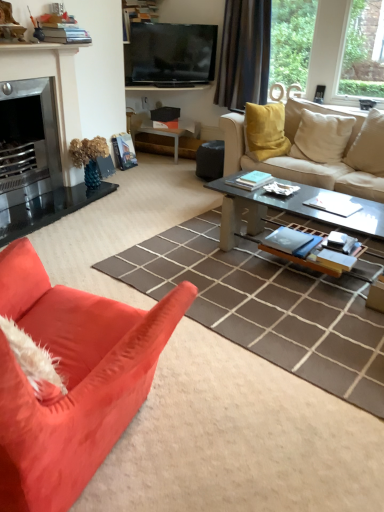
This screenshot has height=512, width=384. Describe the element at coordinates (288, 211) in the screenshot. I see `clear glass coffee table at center` at that location.

What do you see at coordinates (72, 380) in the screenshot? I see `suede-like orange couch at lower left, the second studio couch from the back` at bounding box center [72, 380].

In the scene shown: Measure the distance between point (271, 167) and camera.

They are 11.14 feet apart.

What are the coordinates of `beige fabric pillow at right, positioned as the 1th pillow in left-to-right order` in the screenshot? It's located at (322, 136).

Image resolution: width=384 pixels, height=512 pixels. In order to click on beige fabric pillow at upper right, the 1th pillow viewed from the right in this screenshot , I will do `click(368, 146)`.

Can you tell me how much beige fabric couch at upper right, acting as the 1th studio couch starting from the right, and suede-like orange couch at lower left, the second studio couch from the back, differ in facing direction?

They differ by 168 degrees in their facing directions.

Considering the sizes of beige fabric couch at upper right, the first studio couch in the back-to-front sequence, and suede-like orange couch at lower left, which is the first studio couch in bottom-to-top order, in the image, is beige fabric couch at upper right, the first studio couch in the back-to-front sequence, taller or shorter than suede-like orange couch at lower left, which is the first studio couch in bottom-to-top order,?

beige fabric couch at upper right, the first studio couch in the back-to-front sequence, is shorter than suede-like orange couch at lower left, which is the first studio couch in bottom-to-top order.

Which object is thinner, beige fabric couch at upper right, acting as the 1th studio couch starting from the right, or suede-like orange couch at lower left, the 2th studio couch when ordered from top to bottom?

suede-like orange couch at lower left, the 2th studio couch when ordered from top to bottom, is thinner.

Based on the photo, is beige fabric couch at upper right, placed as the 1th studio couch when sorted from top to bottom, smaller than suede-like orange couch at lower left, the 2th studio couch when ordered from top to bottom?

Actually, beige fabric couch at upper right, placed as the 1th studio couch when sorted from top to bottom, might be larger than suede-like orange couch at lower left, the 2th studio couch when ordered from top to bottom.

From a real-world perspective, is beige fabric couch at upper right, the 2th studio couch when ordered from front to back, on top of black fabric curtain at upper center?

Actually, beige fabric couch at upper right, the 2th studio couch when ordered from front to back, is physically below black fabric curtain at upper center in the real world.

Looking at this image, is beige fabric couch at upper right, arranged as the 2th studio couch when ordered from the bottom, positioned with its back to black fabric curtain at upper center?

No, beige fabric couch at upper right, arranged as the 2th studio couch when ordered from the bottom, is not facing the opposite direction of black fabric curtain at upper center.

Who is more distant, beige fabric couch at upper right, which ranks as the 2th studio couch in left-to-right order, or black fabric curtain at upper center?

black fabric curtain at upper center is more distant.

Consider the image. Is beige fabric couch at upper right, the 2th studio couch when ordered from front to back, inside the boundaries of black fabric curtain at upper center, or outside?

beige fabric couch at upper right, the 2th studio couch when ordered from front to back, is not enclosed by black fabric curtain at upper center.

Who is bigger, clear glass coffee table at center or beige fabric couch at upper right, the first studio couch in the back-to-front sequence?

beige fabric couch at upper right, the first studio couch in the back-to-front sequence.

Find the location of a particular element. the 1st studio couch located above the clear glass coffee table at center (from a real-world perspective) is located at coordinates (314, 160).

From the image's perspective, is clear glass coffee table at center located above beige fabric couch at upper right, the first studio couch in the back-to-front sequence?

Incorrect, from the image's perspective, clear glass coffee table at center is lower than beige fabric couch at upper right, the first studio couch in the back-to-front sequence.

Considering the sizes of objects clear glass coffee table at center and beige fabric couch at upper right, which ranks as the 2th studio couch in left-to-right order, in the image provided, who is taller, clear glass coffee table at center or beige fabric couch at upper right, which ranks as the 2th studio couch in left-to-right order,?

beige fabric couch at upper right, which ranks as the 2th studio couch in left-to-right order.

Consider the image. Is beige fabric pillow at right, the 2th pillow from the right, inside the boundaries of beige fabric pillow at upper right, the 1th pillow viewed from the right, or outside?

beige fabric pillow at right, the 2th pillow from the right, cannot be found inside beige fabric pillow at upper right, the 1th pillow viewed from the right.

Is beige fabric pillow at right, positioned as the 1th pillow in left-to-right order, oriented towards beige fabric pillow at upper right, the 1th pillow viewed from the right?

No, beige fabric pillow at right, positioned as the 1th pillow in left-to-right order, is not aimed at beige fabric pillow at upper right, the 1th pillow viewed from the right.

From the picture: From the image's perspective, would you say beige fabric pillow at right, positioned as the 1th pillow in left-to-right order, is positioned over beige fabric pillow at upper right, the 1th pillow viewed from the right?

Indeed, from the image's perspective, beige fabric pillow at right, positioned as the 1th pillow in left-to-right order, is shown above beige fabric pillow at upper right, the 1th pillow viewed from the right.

Who is bigger, beige fabric pillow at right, positioned as the 1th pillow in left-to-right order, or beige fabric pillow at upper right, the 1th pillow viewed from the right?

beige fabric pillow at right, positioned as the 1th pillow in left-to-right order, is bigger.

Is brushed metal fireplace at left facing towards clear glass coffee table at center?

Yes.

Does point (4, 217) come closer to viewer compared to point (382, 232)?

That is False.

Is brushed metal fireplace at left thinner than clear glass coffee table at center?

Indeed, brushed metal fireplace at left has a lesser width compared to clear glass coffee table at center.

Does brushed metal fireplace at left lie in front of clear glass coffee table at center?

No, brushed metal fireplace at left is further to the viewer.

Are beige fabric couch at upper right, placed as the 1th studio couch when sorted from top to bottom, and beige fabric pillow at upper right, the 1th pillow viewed from the right, far apart?

No, beige fabric couch at upper right, placed as the 1th studio couch when sorted from top to bottom, is not far from beige fabric pillow at upper right, the 1th pillow viewed from the right.

How much distance is there between beige fabric couch at upper right, which ranks as the 2th studio couch in left-to-right order, and beige fabric pillow at upper right, the 1th pillow viewed from the right?

They are 10.64 inches apart.

Starting from the beige fabric couch at upper right, acting as the 1th studio couch starting from the right, which pillow is the 1st one behind? Please provide its 2D coordinates.

[(368, 146)]

Are flat screen tv at upper center and suede-like orange couch at lower left, the 2th studio couch when ordered from top to bottom, making contact?

No, flat screen tv at upper center is not next to suede-like orange couch at lower left, the 2th studio couch when ordered from top to bottom.

Does flat screen tv at upper center contain suede-like orange couch at lower left, which is counted as the 1th studio couch, starting from the left?

No, suede-like orange couch at lower left, which is counted as the 1th studio couch, starting from the left, is not surrounded by flat screen tv at upper center.

In the scene shown: Is flat screen tv at upper center facing towards suede-like orange couch at lower left, which is counted as the first studio couch, starting from the front?

Yes, flat screen tv at upper center is aimed at suede-like orange couch at lower left, which is counted as the first studio couch, starting from the front.

Between flat screen tv at upper center and suede-like orange couch at lower left, the 2th studio couch when ordered from top to bottom, which one has more height?

Standing taller between the two is suede-like orange couch at lower left, the 2th studio couch when ordered from top to bottom.

Find the location of a particular element. This screenshot has height=512, width=384. studio couch on the left of beige fabric couch at upper right, placed as the 1th studio couch when sorted from top to bottom is located at coordinates (72, 380).

The height and width of the screenshot is (512, 384). In order to click on the 2nd studio couch located beneath the black fabric curtain at upper center (from a real-world perspective) in this screenshot , I will do `click(314, 160)`.

From the image, which object appears to be farther from black fabric curtain at upper center, flat screen tv at upper center or clear glass coffee table at center?

Based on the image, clear glass coffee table at center appears to be further to black fabric curtain at upper center.

Estimate the real-world distances between objects in this image. Which object is further from flat screen tv at upper center, beige fabric pillow at right, positioned as the 1th pillow in left-to-right order, or matte white side table at center?

The object further to flat screen tv at upper center is beige fabric pillow at right, positioned as the 1th pillow in left-to-right order.

Considering their positions, is matte white side table at center positioned closer to flat screen tv at upper center than suede-like orange couch at lower left, the 2th studio couch when ordered from top to bottom?

matte white side table at center is closer to flat screen tv at upper center.

Looking at the image, which one is located closer to black fabric curtain at upper center, beige fabric pillow at right, positioned as the 1th pillow in left-to-right order, or brushed metal fireplace at left?

Based on the image, beige fabric pillow at right, positioned as the 1th pillow in left-to-right order, appears to be nearer to black fabric curtain at upper center.

Which object lies nearer to the anchor point beige fabric couch at upper right, which ranks as the 2th studio couch in left-to-right order, beige fabric pillow at right, positioned as the 1th pillow in left-to-right order, or matte white side table at center?

beige fabric pillow at right, positioned as the 1th pillow in left-to-right order, is closer to beige fabric couch at upper right, which ranks as the 2th studio couch in left-to-right order.

Based on their spatial positions, is beige fabric pillow at upper right, the 1th pillow viewed from the right, or brushed metal fireplace at left closer to matte white side table at center?

brushed metal fireplace at left is closer to matte white side table at center.

Which object lies further to the anchor point black fabric curtain at upper center, flat screen tv at upper center or beige fabric couch at upper right, the first studio couch in the back-to-front sequence?

Based on the image, beige fabric couch at upper right, the first studio couch in the back-to-front sequence, appears to be further to black fabric curtain at upper center.

Estimate the real-world distances between objects in this image. Which object is further from beige fabric pillow at upper right, positioned as the second pillow in left-to-right order, beige fabric couch at upper right, arranged as the 2th studio couch when ordered from the bottom, or beige fabric pillow at right, positioned as the 1th pillow in left-to-right order?

beige fabric couch at upper right, arranged as the 2th studio couch when ordered from the bottom.

Image resolution: width=384 pixels, height=512 pixels. I want to click on television between clear glass coffee table at center and matte white side table at center from front to back, so click(x=170, y=54).

Find the location of a particular element. This screenshot has height=512, width=384. studio couch between brushed metal fireplace at left and beige fabric couch at upper right, arranged as the 2th studio couch when ordered from the bottom, in the horizontal direction is located at coordinates (72, 380).

This screenshot has width=384, height=512. I want to click on studio couch between flat screen tv at upper center and beige fabric pillow at upper right, positioned as the second pillow in left-to-right order, from left to right, so click(x=314, y=160).

Image resolution: width=384 pixels, height=512 pixels. Find the location of `studio couch between suede-like orange couch at lower left, the 2th studio couch when ordered from top to bottom, and beige fabric pillow at upper right, positioned as the second pillow in left-to-right order, from front to back`. studio couch between suede-like orange couch at lower left, the 2th studio couch when ordered from top to bottom, and beige fabric pillow at upper right, positioned as the second pillow in left-to-right order, from front to back is located at coordinates (314, 160).